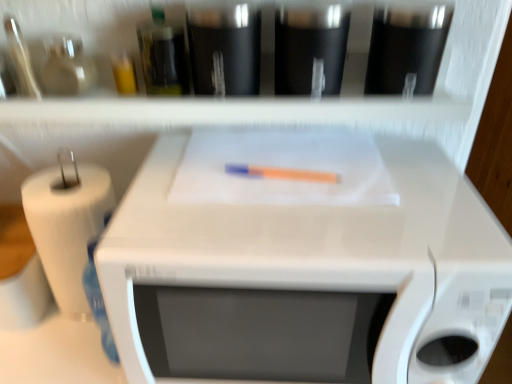
Describe the element at coordinates (282, 173) in the screenshot. I see `orange matte crayon at center` at that location.

What do you see at coordinates (67, 225) in the screenshot? The height and width of the screenshot is (384, 512). I see `white paper at left` at bounding box center [67, 225].

Locate an element on the screen. This screenshot has height=384, width=512. white glossy microwave at center is located at coordinates (317, 253).

Is white matte shelf at upper center facing away from orange matte crayon at center?

No, white matte shelf at upper center's orientation is not away from orange matte crayon at center.

Considering the relative sizes of white matte shelf at upper center and orange matte crayon at center in the image provided, is white matte shelf at upper center taller than orange matte crayon at center?

Indeed, white matte shelf at upper center has a greater height compared to orange matte crayon at center.

Considering the positions of objects white matte shelf at upper center and orange matte crayon at center in the image provided, who is behind, white matte shelf at upper center or orange matte crayon at center?

orange matte crayon at center is further away from the camera.

The height and width of the screenshot is (384, 512). There is a orange matte crayon at center. In order to click on shelf above it (from a real-world perspective) in this screenshot , I will do `click(309, 98)`.

Is point (419, 96) farther from camera compared to point (97, 196)?

No, (419, 96) is closer to viewer.

Is white matte shelf at upper center next to white paper at left?

No, white matte shelf at upper center is not next to white paper at left.

Could you tell me if white matte shelf at upper center is turned towards white paper at left?

No, white matte shelf at upper center is not oriented towards white paper at left.

Can you tell me how much white glossy microwave at center and white paper at left differ in facing direction?

They differ by 0.00022 degrees in their facing directions.

Would you say white glossy microwave at center contains white paper at left?

No.

At what (x,y) coordinates should I click in order to perform the action: click on appliance that appears in front of the white paper at left. Please return your answer as a coordinate pair (x, y). Looking at the image, I should click on (317, 253).

Which of these two, white glossy microwave at center or white paper at left, stands taller?

Standing taller between the two is white glossy microwave at center.

Which is more distant, (297, 174) or (240, 220)?

The point (297, 174) is farther.

Is orange matte crayon at center facing towards white glossy microwave at center?

Yes, orange matte crayon at center faces towards white glossy microwave at center.

From the image's perspective, is orange matte crayon at center located above white glossy microwave at center?

Indeed, from the image's perspective, orange matte crayon at center is shown above white glossy microwave at center.

From the image's perspective, which object appears higher, white matte shelf at upper center or white glossy microwave at center?

white matte shelf at upper center is shown above in the image.

Is white matte shelf at upper center in front of or behind white glossy microwave at center in the image?

In the image, white matte shelf at upper center appears behind white glossy microwave at center.

Could you tell me if white matte shelf at upper center is facing white glossy microwave at center?

No, white matte shelf at upper center is not turned towards white glossy microwave at center.

Consider the image. From the image's perspective, which one is positioned lower, white paper at left or white glossy microwave at center?

white glossy microwave at center appears lower in the image.

Does white paper at left contain white glossy microwave at center?

No, white glossy microwave at center is located outside of white paper at left.

Can you confirm if white paper at left is shorter than white glossy microwave at center?

Yes, white paper at left is shorter than white glossy microwave at center.

Which object is thinner, white paper at left or white glossy microwave at center?

Thinner between the two is white paper at left.

Is point (61, 238) farther from camera compared to point (269, 78)?

No, it is not.

At what (x,y) coordinates should I click in order to perform the action: click on shelf above the white paper at left (from a real-world perspective). Please return your answer as a coordinate pair (x, y). The height and width of the screenshot is (384, 512). Looking at the image, I should click on (309, 98).

From a real-world perspective, relative to white matte shelf at upper center, is white paper at left vertically above or below?

Clearly, from a real-world perspective, white paper at left is below white matte shelf at upper center.

Is white paper at left looking in the opposite direction of white matte shelf at upper center?

No, white paper at left is not facing the opposite direction of white matte shelf at upper center.

At what (x,y) coordinates should I click in order to perform the action: click on crayon on the right of white matte shelf at upper center. Please return your answer as a coordinate pair (x, y). Looking at the image, I should click on (282, 173).

At what (x,y) coordinates should I click in order to perform the action: click on paper towel on the left side of white matte shelf at upper center. Please return your answer as a coordinate pair (x, y). Looking at the image, I should click on (67, 225).

Looking at this image, estimate the real-world distances between objects in this image. Which object is further from white glossy microwave at center, white paper at left or orange matte crayon at center?

The object further to white glossy microwave at center is white paper at left.

In the scene shown: When comparing their distances from white matte shelf at upper center, does orange matte crayon at center or white glossy microwave at center seem further?

orange matte crayon at center is positioned further to the anchor white matte shelf at upper center.

Estimate the real-world distances between objects in this image. Which object is closer to orange matte crayon at center, white matte shelf at upper center or white glossy microwave at center?

The object closer to orange matte crayon at center is white glossy microwave at center.

Considering their positions, is white matte shelf at upper center positioned closer to orange matte crayon at center than white paper at left?

white matte shelf at upper center is positioned closer to the anchor orange matte crayon at center.

Which object lies further to the anchor point orange matte crayon at center, white paper at left or white glossy microwave at center?

white paper at left is positioned further to the anchor orange matte crayon at center.

Based on their spatial positions, is white glossy microwave at center or white paper at left closer to white matte shelf at upper center?

white glossy microwave at center lies closer to white matte shelf at upper center than the other object.

Looking at the image, which one is located closer to white glossy microwave at center, orange matte crayon at center or white paper at left?

Among the two, orange matte crayon at center is located nearer to white glossy microwave at center.

From the image, which object appears to be nearer to white matte shelf at upper center, white paper at left or orange matte crayon at center?

The object closer to white matte shelf at upper center is orange matte crayon at center.

Identify the location of crayon between white matte shelf at upper center and white glossy microwave at center in the vertical direction. [x=282, y=173].

The width and height of the screenshot is (512, 384). Find the location of `crayon between white paper at left and white glossy microwave at center from left to right`. crayon between white paper at left and white glossy microwave at center from left to right is located at coordinates (282, 173).

This screenshot has height=384, width=512. I want to click on shelf located between white paper at left and orange matte crayon at center in the left-right direction, so click(309, 98).

I want to click on shelf situated between white paper at left and white glossy microwave at center from left to right, so (x=309, y=98).